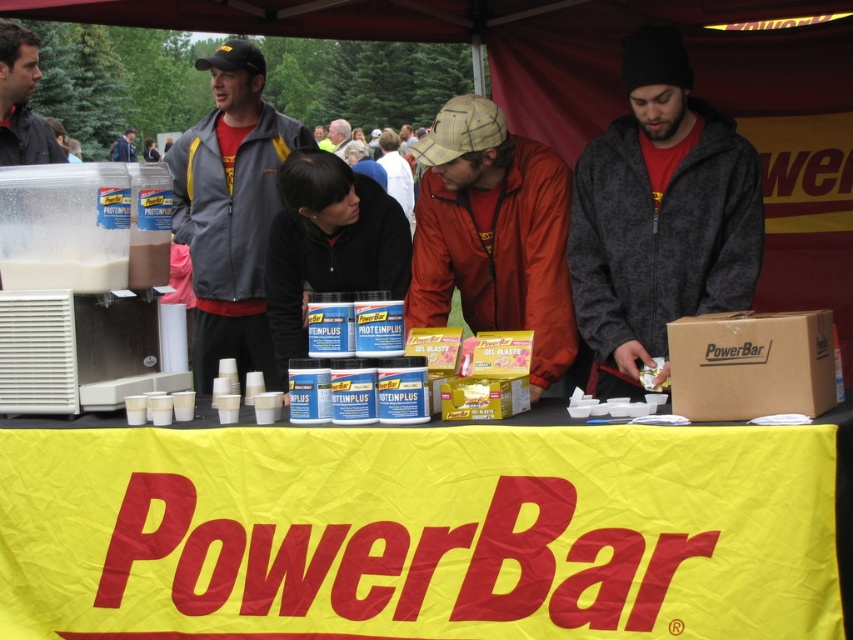
Question: Which point is closer to the camera taking this photo?

Choices:
 (A) (553, 284)
 (B) (9, 138)
 (C) (254, 67)
 (D) (345, 124)

Answer: (A)

Question: Is the position of dark gray zip-up hoodie at center less distant than that of gray softshell jacket at center?

Choices:
 (A) yes
 (B) no

Answer: (A)

Question: Which point is closer to the camera taking this photo?

Choices:
 (A) (677, 49)
 (B) (340, 132)
 (C) (778, 496)

Answer: (C)

Question: Is yellow fabric banner at center wider than black shirt at upper left?

Choices:
 (A) no
 (B) yes

Answer: (B)

Question: Which object is closer to the camera taking this photo?

Choices:
 (A) red jacket at center
 (B) matte black jacket at center
 (C) black shirt at upper left

Answer: (A)

Question: Is red jacket at center further to camera compared to black shirt at upper left?

Choices:
 (A) yes
 (B) no

Answer: (B)